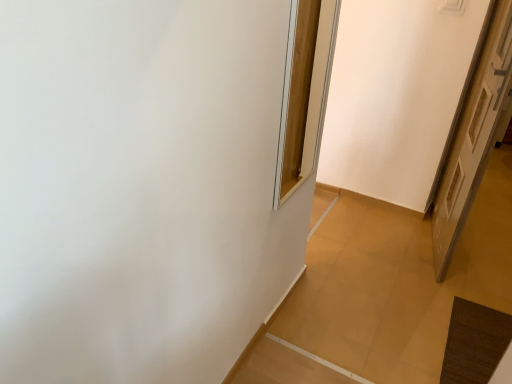
You are a GUI agent. You are given a task and a screenshot of the screen. Output one action in this format:
    pyautogui.click(x=<x>, y=<y>)
    Task: Click on the free space in front of white wooden door at right
    The image size is (512, 384).
    Given the screenshot: What is the action you would take?
    pyautogui.click(x=452, y=296)